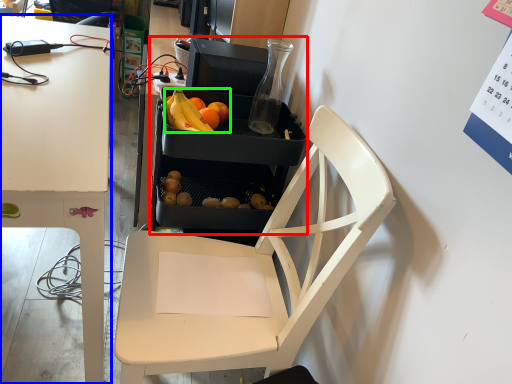
Question: Estimate the real-world distances between objects in this image. Which object is farther from appliance (highlighted by a red box), desk (highlighted by a blue box) or grapefruit (highlighted by a green box)?

Choices:
 (A) desk
 (B) grapefruit

Answer: (A)